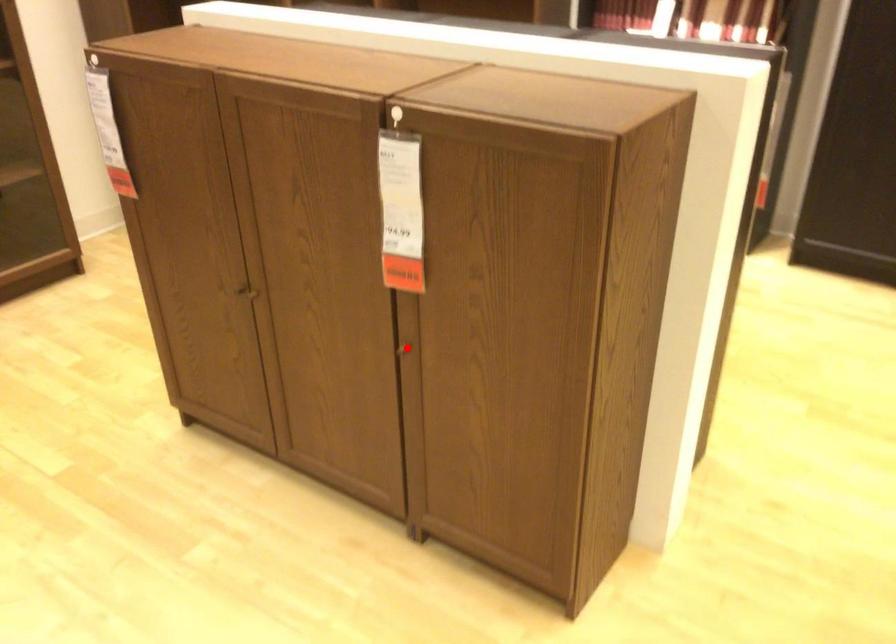
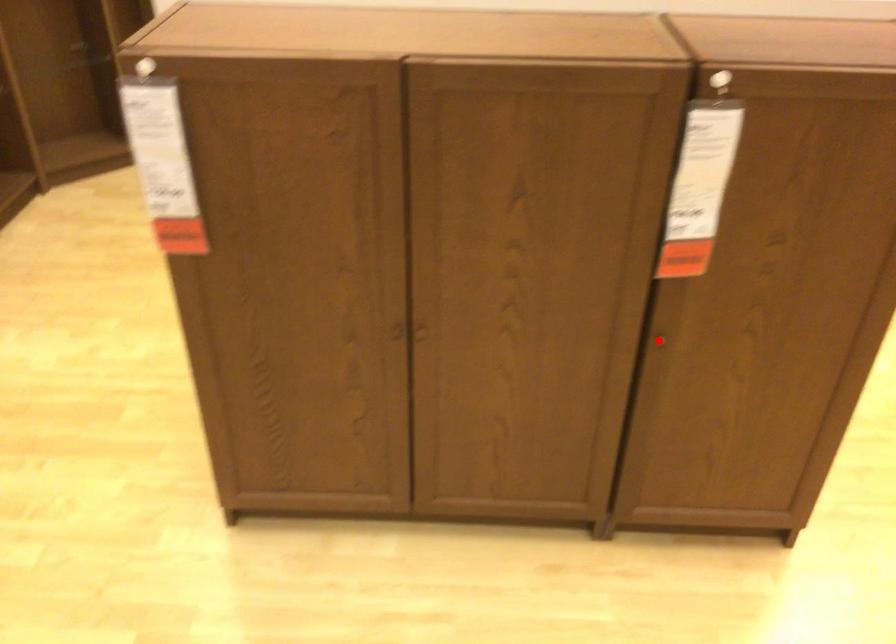
I am providing you with two images of the same scene from different viewpoints. A red point is marked on the first image and another point is marked on the second image. Is the marked point in image1 the same physical position as the marked point in image2?

Yes